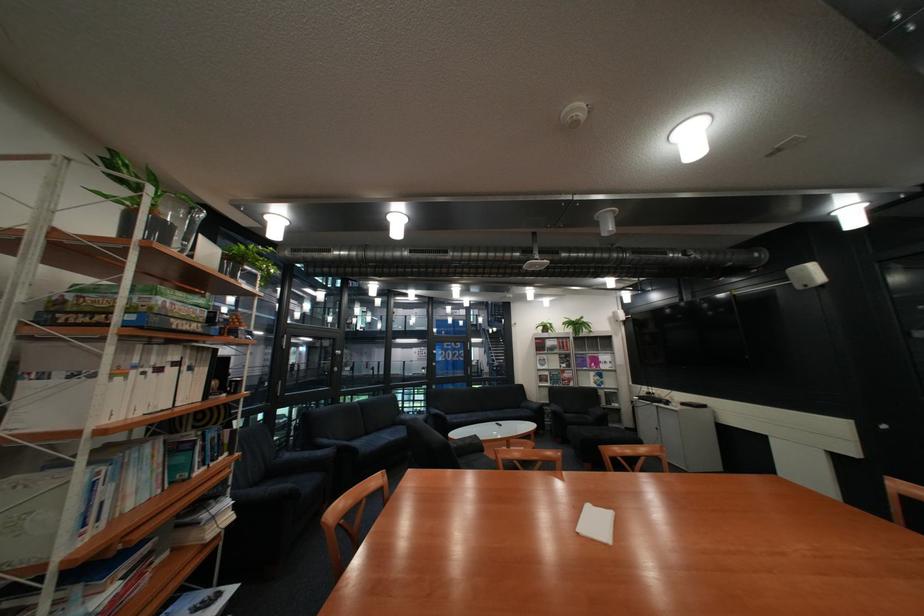
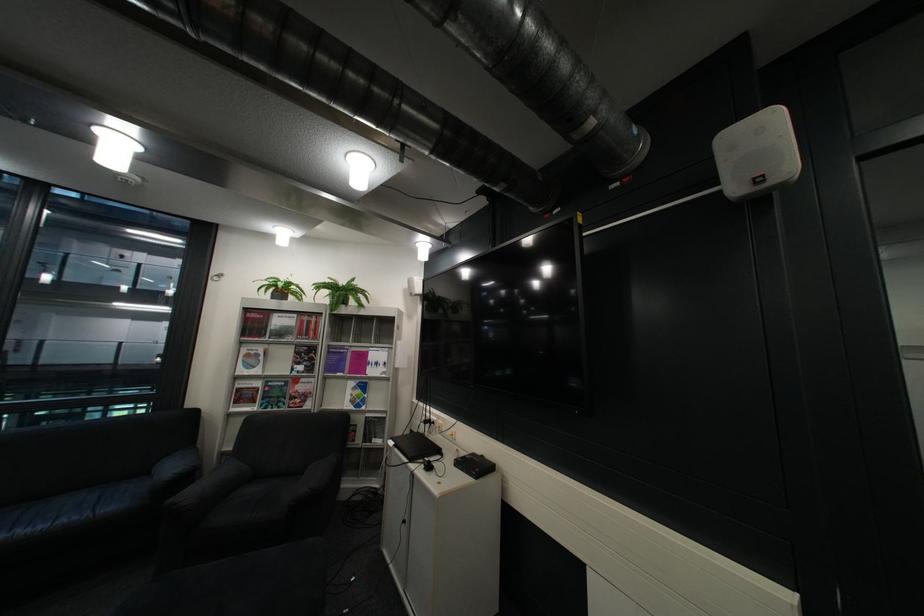
Where in the second image is the point corresponding to point (556, 328) from the first image?

(287, 290)